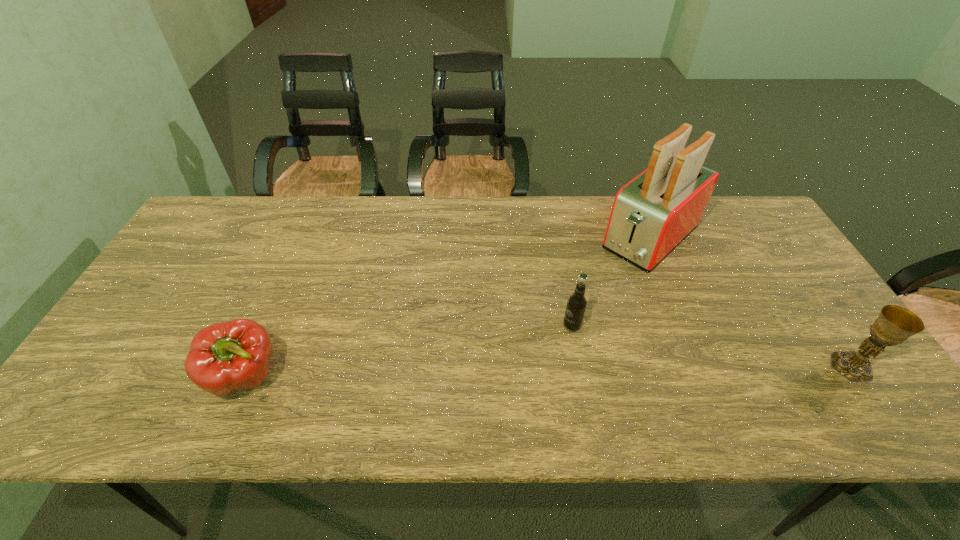
This screenshot has height=540, width=960. Identify the location of the leftmost object. pos(225,357).

Locate an element on the screen. the rightmost object is located at coordinates (894, 324).

Where is `the farthest object`? the farthest object is located at coordinates (651, 215).

The width and height of the screenshot is (960, 540). I want to click on toaster, so click(651, 215).

The width and height of the screenshot is (960, 540). In order to click on the second object from left to right in this screenshot , I will do `click(576, 305)`.

Locate an element on the screen. the second farthest object is located at coordinates (576, 305).

This screenshot has width=960, height=540. Identify the location of vacant space located 0.050m on the back of the pepper. (266, 331).

I want to click on vacant space located on the left of the chalice, so click(712, 367).

Locate an element on the screen. free region located on the front-facing side of the tallest object is located at coordinates (611, 273).

Identify the location of vacant space located on the front-facing side of the tallest object. This screenshot has width=960, height=540. (565, 314).